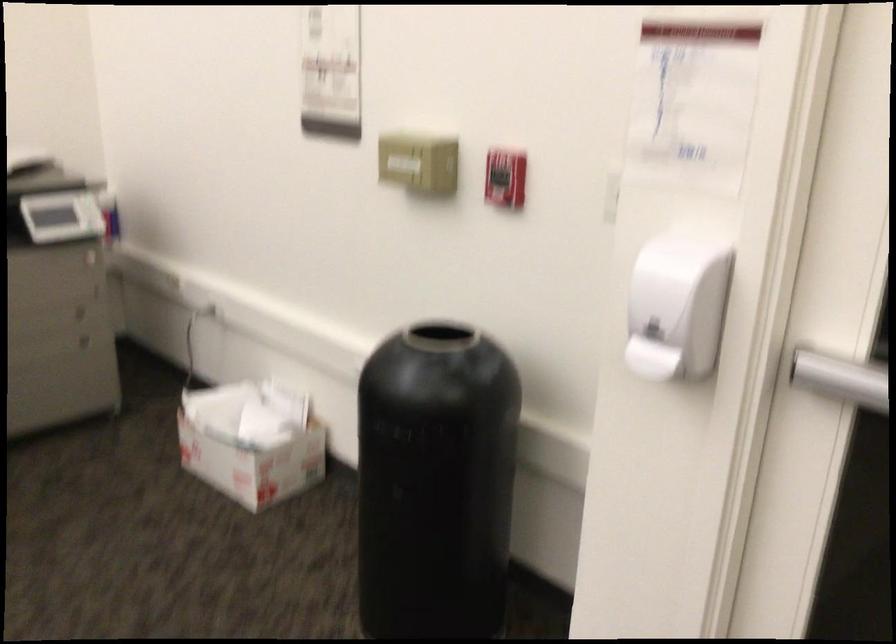
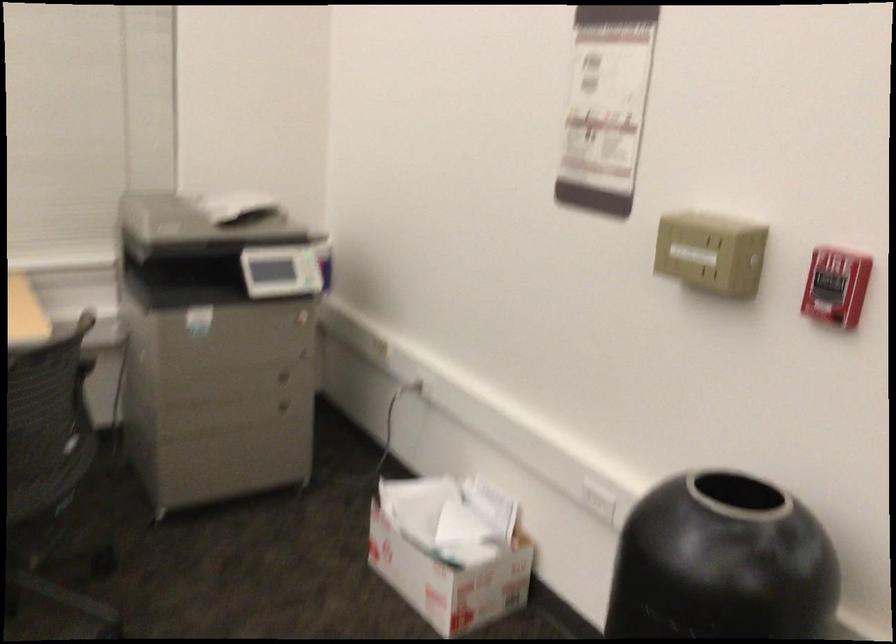
The images are taken continuously from a first-person perspective. In which direction are you moving?

The movement direction of the cameraman is left, forward.